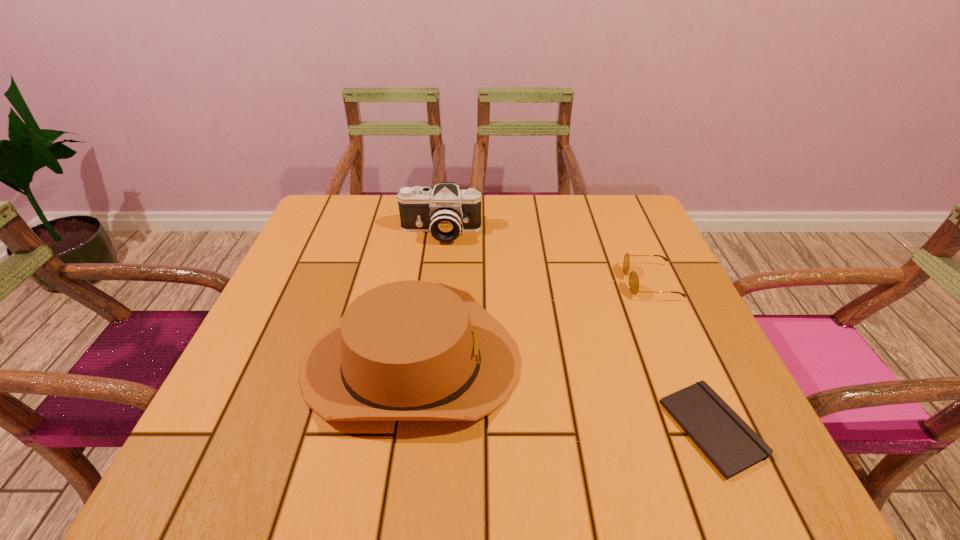
At what (x,y) coordinates should I click in order to perform the action: click on camera. Please return your answer as a coordinate pair (x, y). This screenshot has width=960, height=540. Looking at the image, I should click on (446, 212).

Locate an element on the screen. This screenshot has width=960, height=540. the second tallest object is located at coordinates (411, 350).

You are a GUI agent. You are given a task and a screenshot of the screen. Output one action in this format:
    pyautogui.click(x=<x>, y=<y>)
    Task: Click on the third nearest object
    
    Given the screenshot: What is the action you would take?
    [x=633, y=278]

Identify the location of the third tallest object. This screenshot has width=960, height=540. (633, 278).

The width and height of the screenshot is (960, 540). What are the coordinates of `the shortest object` in the screenshot? It's located at (732, 446).

This screenshot has width=960, height=540. I want to click on vacant space located 0.190m on the right of the camera, so click(x=553, y=232).

Locate an element on the screen. Image resolution: width=960 pixels, height=540 pixels. vacant space located on the front-facing side of the third shortest object is located at coordinates (693, 361).

Locate an element on the screen. This screenshot has height=540, width=960. vacant space located on the lenses of the second farthest object is located at coordinates (516, 282).

Identify the location of vacant area situated on the lenses of the second farthest object. This screenshot has height=540, width=960. tap(478, 282).

Identify the location of vacant point located on the lenses of the second farthest object. (578, 282).